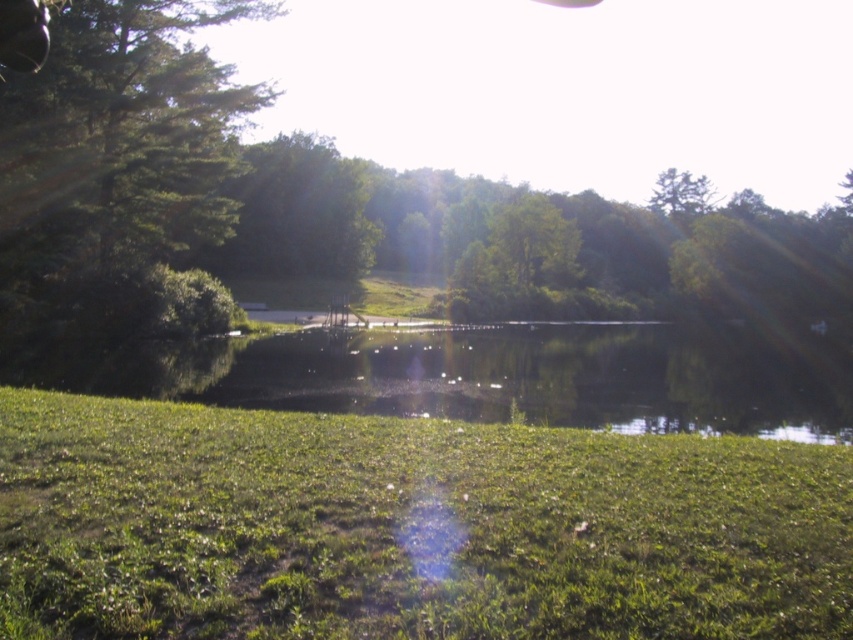
Does green grassy at lower center have a larger size compared to green leafy tree at upper left?

No, green grassy at lower center is not bigger than green leafy tree at upper left.

Is point (316, 509) more distant than point (61, 88)?

No, (316, 509) is closer to viewer.

Is point (427, 592) in front of point (62, 19)?

That is True.

Where is `green grassy at lower center`? The width and height of the screenshot is (853, 640). green grassy at lower center is located at coordinates (405, 528).